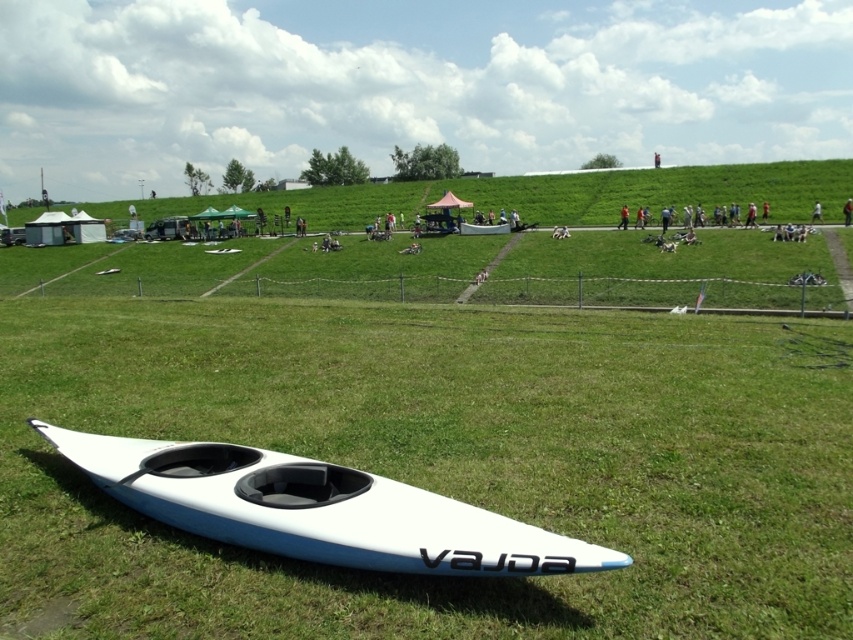
What do you see at coordinates (816, 212) in the screenshot?
I see `dark blue fabric person at center` at bounding box center [816, 212].

Between dark blue fabric person at center and white matte kayak at lower left, which one has more height?

white matte kayak at lower left is taller.

What do you see at coordinates (816, 212) in the screenshot? This screenshot has height=640, width=853. I see `dark blue fabric person at center` at bounding box center [816, 212].

Identify the location of dark blue fabric person at center. Image resolution: width=853 pixels, height=640 pixels. (816, 212).

Which is in front, point (477, 227) or point (813, 205)?

Point (477, 227) is more forward.

What are the coordinates of `white matte kayak at center` in the screenshot? It's located at (483, 228).

Where is `white matte kayak at center`? white matte kayak at center is located at coordinates (483, 228).

Does white plastic kayak at lower left have a larger size compared to green grassy hillside at upper center?

Actually, white plastic kayak at lower left might be smaller than green grassy hillside at upper center.

What do you see at coordinates (317, 509) in the screenshot? I see `white plastic kayak at lower left` at bounding box center [317, 509].

Identify the location of white plastic kayak at lower left. This screenshot has height=640, width=853. [317, 509].